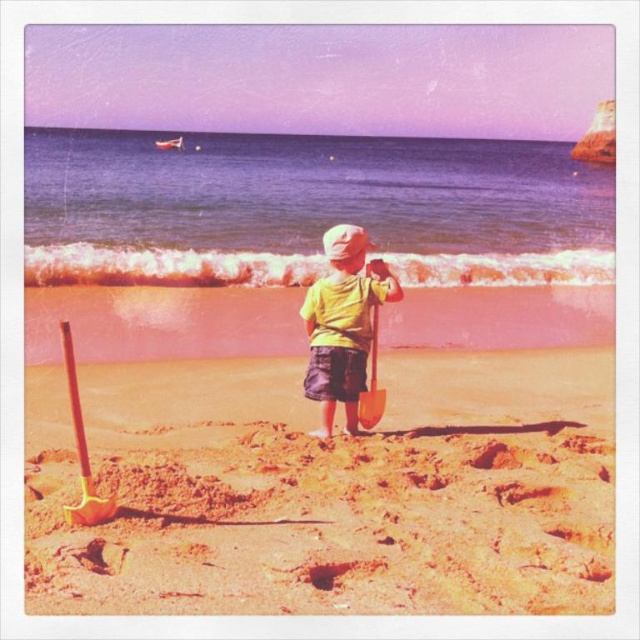
Is yellow matte shirt at center below wooden shovel at lower left?

Actually, yellow matte shirt at center is above wooden shovel at lower left.

Is yellow matte shirt at center behind wooden shovel at lower left?

Yes, it is.

Identify the location of yellow matte shirt at center. pyautogui.click(x=342, y=323).

Between point (72, 406) and point (380, 417), which one is positioned behind?

The point (380, 417) is more distant.

Identify the location of wooden shovel at lower left. This screenshot has width=640, height=640. (81, 449).

Which is behind, point (68, 364) or point (372, 372)?

Positioned behind is point (68, 364).

Image resolution: width=640 pixels, height=640 pixels. Identify the location of wooden shovel at lower left. (81, 449).

Who is lower down, smooth sand shovel at center or metallic gold shovel at center?

Positioned lower is smooth sand shovel at center.

This screenshot has height=640, width=640. What do you see at coordinates (328, 488) in the screenshot?
I see `smooth sand shovel at center` at bounding box center [328, 488].

What do you see at coordinates (328, 488) in the screenshot? I see `smooth sand shovel at center` at bounding box center [328, 488].

The height and width of the screenshot is (640, 640). I want to click on smooth sand shovel at center, so 328,488.